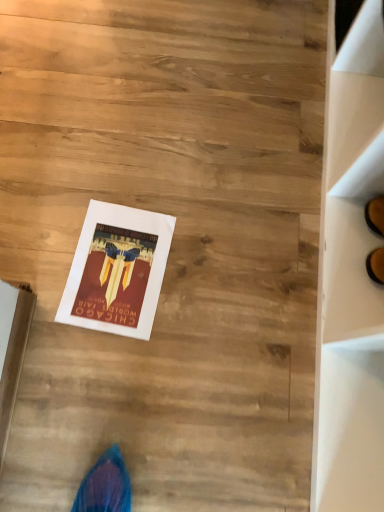
Question: Should I look upward or downward to see white cardboard box at lower left?

Choices:
 (A) up
 (B) down

Answer: (B)

Question: Does matte paper poster at center touch white cardboard box at lower left?

Choices:
 (A) yes
 (B) no

Answer: (B)

Question: Is the position of matte paper poster at center less distant than that of white cardboard box at lower left?

Choices:
 (A) yes
 (B) no

Answer: (B)

Question: Is matte paper poster at center positioned behind white cardboard box at lower left?

Choices:
 (A) no
 (B) yes

Answer: (B)

Question: Considering the relative sizes of matte paper poster at center and white cardboard box at lower left in the image provided, is matte paper poster at center smaller than white cardboard box at lower left?

Choices:
 (A) no
 (B) yes

Answer: (A)

Question: From the image's perspective, is matte paper poster at center located beneath white cardboard box at lower left?

Choices:
 (A) yes
 (B) no

Answer: (B)

Question: From a real-world perspective, is matte paper poster at center beneath white cardboard box at lower left?

Choices:
 (A) no
 (B) yes

Answer: (B)

Question: Is white cardboard box at lower left looking in the opposite direction of matte paper poster at center?

Choices:
 (A) no
 (B) yes

Answer: (A)

Question: Does white cardboard box at lower left appear on the left side of matte paper poster at center?

Choices:
 (A) no
 (B) yes

Answer: (B)

Question: Considering the relative sizes of white cardboard box at lower left and matte paper poster at center in the image provided, is white cardboard box at lower left smaller than matte paper poster at center?

Choices:
 (A) yes
 (B) no

Answer: (A)

Question: Is white cardboard box at lower left outside matte paper poster at center?

Choices:
 (A) yes
 (B) no

Answer: (A)

Question: From the image's perspective, is white cardboard box at lower left above matte paper poster at center?

Choices:
 (A) yes
 (B) no

Answer: (B)

Question: Can you confirm if white cardboard box at lower left is taller than matte paper poster at center?

Choices:
 (A) no
 (B) yes

Answer: (B)

Question: From the image's perspective, is white cardboard box at lower left positioned above or below matte paper poster at center?

Choices:
 (A) below
 (B) above

Answer: (A)